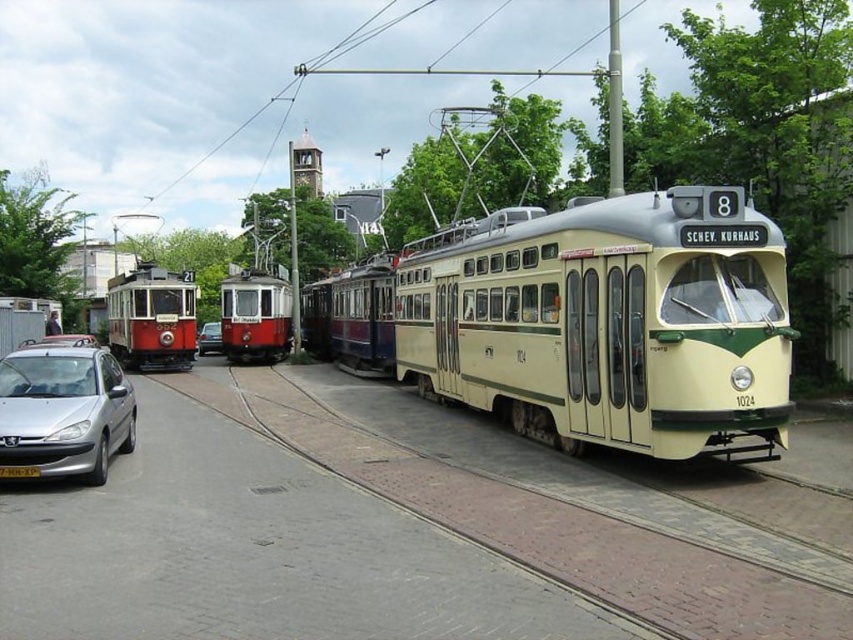
Which of these two, silver metallic hatchback at lower left or metallic silver car at center, stands shorter?

silver metallic hatchback at lower left is shorter.

Can you confirm if silver metallic hatchback at lower left is smaller than metallic silver car at center?

Yes.

Does point (39, 397) lie behind point (212, 342)?

That is False.

The image size is (853, 640). I want to click on silver metallic hatchback at lower left, so click(62, 412).